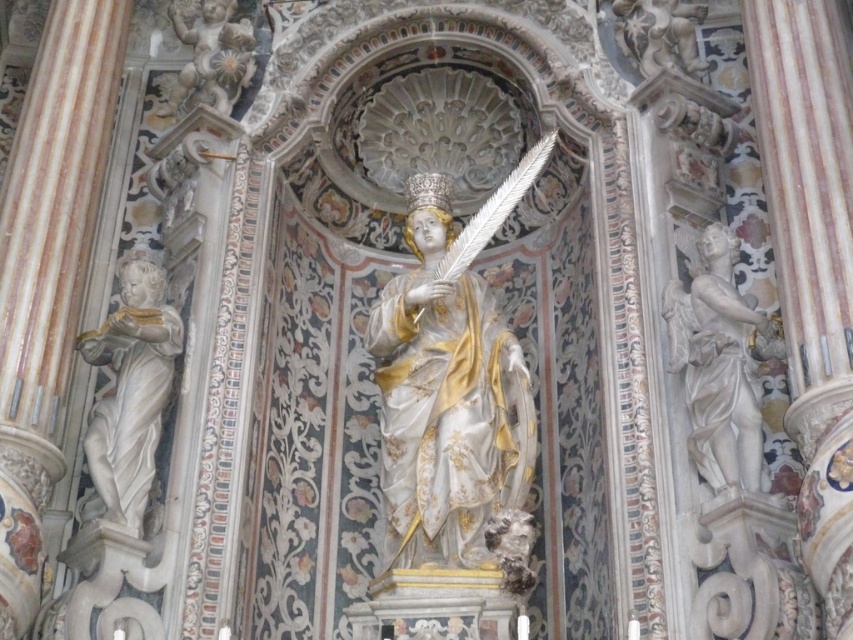
You are an art conservator assessing the space for preservation. The white marble statue at right and the polished marble cherub at upper left are both made of marble. Based on their sizes, which one might require a larger base to prevent toppling?

The white marble statue at right is bigger than the polished marble cherub at upper left, so it would require a larger base to prevent toppling.

You are standing in front of the religious altar and want to touch both points on the statue. Which point, point (401, 346) or point (135, 339), will you reach first as you move towards the altar?

Point (401, 346) is closer to you than point (135, 339), so you will reach point (401, 346) first as you move towards the altar.

Based on the photo, you are an art conservator assessing the space for a new exhibition. You need to ensure that the polished gold statue at center and the white marble statue at left are positioned so that the taller one is placed in the central focal point. Based on the description, is the current arrangement correct?

Yes, the current arrangement is correct because the polished gold statue at center is taller than the white marble statue at left, so the taller statue is already positioned at the central focal point.